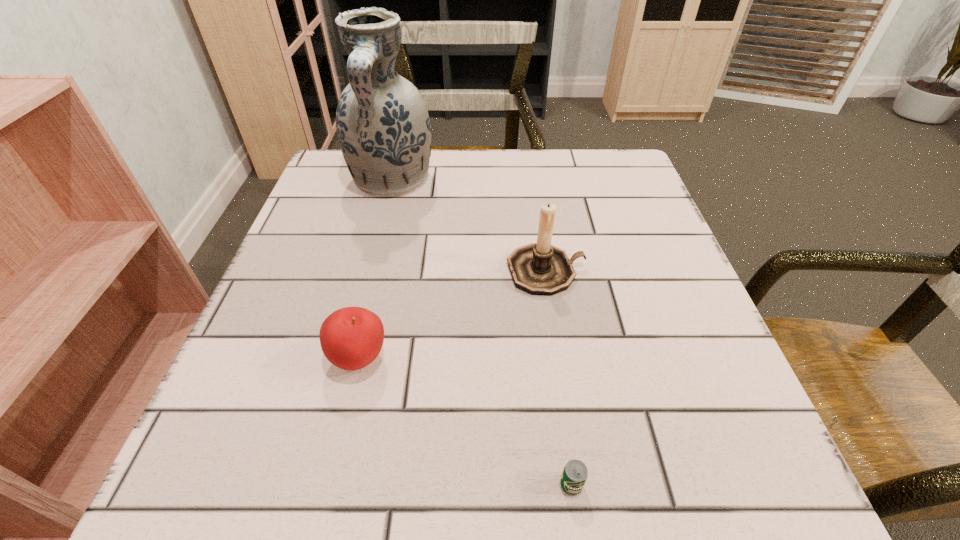
Where is `blank area at the right edge`? blank area at the right edge is located at coordinates (667, 357).

Image resolution: width=960 pixels, height=540 pixels. In the image, there is a desktop. In order to click on vacant space at the far right corner in this screenshot , I will do `click(599, 153)`.

Identify the location of vacant point at the near right corner. (709, 468).

Locate an element on the screen. The height and width of the screenshot is (540, 960). vacant area between the shortest object and the second farthest object is located at coordinates (559, 378).

Where is `empty space that is in between the shortest object and the second nearest object`? empty space that is in between the shortest object and the second nearest object is located at coordinates (466, 422).

Locate an element on the screen. Image resolution: width=960 pixels, height=540 pixels. free space between the tallest object and the nearest object is located at coordinates (482, 333).

Where is `free space between the second tallest object and the farthest object`? The height and width of the screenshot is (540, 960). free space between the second tallest object and the farthest object is located at coordinates (468, 226).

The width and height of the screenshot is (960, 540). I want to click on vacant space that is in between the tallest object and the second farthest object, so click(468, 226).

Identify the location of vacant region between the nearest object and the second nearest object. Image resolution: width=960 pixels, height=540 pixels. (466, 422).

You are a GUI agent. You are given a task and a screenshot of the screen. Output one action in this format:
    pyautogui.click(x=<x>, y=<y>)
    Task: Click on the free space between the third shortest object and the beer can
    
    Given the screenshot: What is the action you would take?
    pyautogui.click(x=559, y=378)